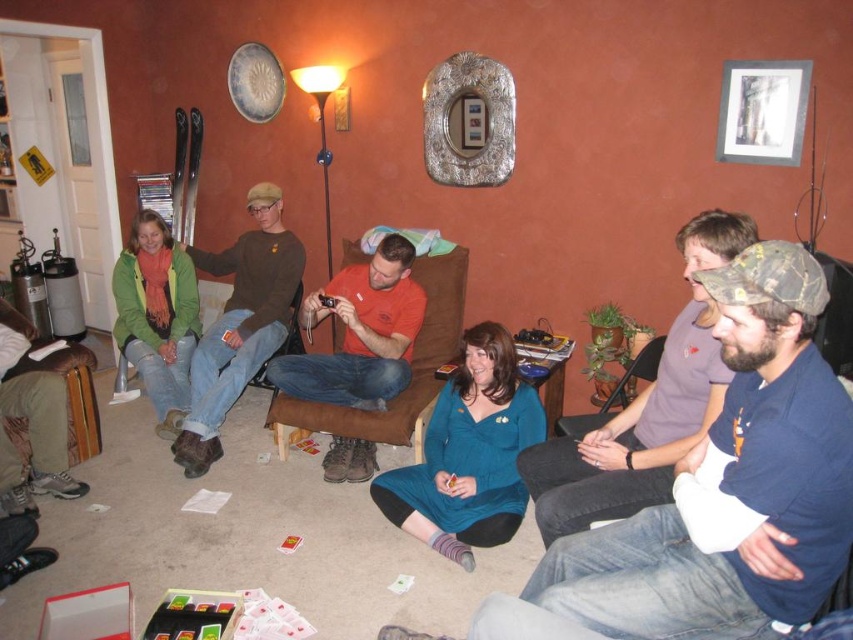
You are a photographer setting up for a group photo in this living room. You need to ensure everyone is visible. The subjects are the dark blue shirt at center and the brown sweater at upper left. Which subject should you adjust to be more visible, and why?

The dark blue shirt at center has a lesser height compared to brown sweater at upper left, so you should adjust the dark blue shirt at center to a higher position to ensure visibility.

You are a guest at this gathering and want to pass a card to the person wearing the orange cotton shirt at center without disturbing the person in the brown sweater at upper left. Which direction should you move towards?

Since the orange cotton shirt at center is located below the brown sweater at upper left, you should move downward to reach the orange cotton shirt at center without disturbing the brown sweater at upper left.